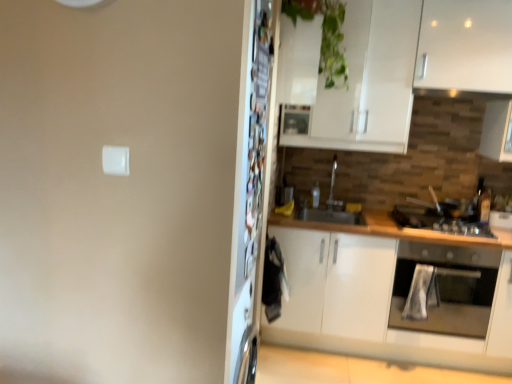
Question: Does metallic refrigerator at center lie in front of black matte gas stove at right?

Choices:
 (A) yes
 (B) no

Answer: (A)

Question: Considering the relative sizes of metallic refrigerator at center and black matte gas stove at right in the image provided, is metallic refrigerator at center taller than black matte gas stove at right?

Choices:
 (A) no
 (B) yes

Answer: (B)

Question: Can you confirm if metallic refrigerator at center is positioned to the right of black matte gas stove at right?

Choices:
 (A) yes
 (B) no

Answer: (B)

Question: From a real-world perspective, is metallic refrigerator at center physically above black matte gas stove at right?

Choices:
 (A) yes
 (B) no

Answer: (A)

Question: Is metallic refrigerator at center positioned beyond the bounds of black matte gas stove at right?

Choices:
 (A) yes
 (B) no

Answer: (A)

Question: In the image, is stainless steel oven at right positioned in front of or behind metallic silver exhaust hood at upper right?

Choices:
 (A) behind
 (B) front

Answer: (B)

Question: Based on their sizes in the image, would you say stainless steel oven at right is bigger or smaller than metallic silver exhaust hood at upper right?

Choices:
 (A) big
 (B) small

Answer: (A)

Question: From a real-world perspective, is stainless steel oven at right above or below metallic silver exhaust hood at upper right?

Choices:
 (A) below
 (B) above

Answer: (A)

Question: Do you think stainless steel oven at right is within metallic silver exhaust hood at upper right, or outside of it?

Choices:
 (A) inside
 (B) outside

Answer: (B)

Question: Relative to white matte cabinet at right, is green glossy plant at upper center in front or behind?

Choices:
 (A) front
 (B) behind

Answer: (A)

Question: From the image's perspective, is green glossy plant at upper center located above or below white matte cabinet at right?

Choices:
 (A) below
 (B) above

Answer: (B)

Question: Is green glossy plant at upper center wider or thinner than white matte cabinet at right?

Choices:
 (A) wide
 (B) thin

Answer: (B)

Question: From a real-world perspective, is green glossy plant at upper center above or below white matte cabinet at right?

Choices:
 (A) above
 (B) below

Answer: (A)

Question: From a real-world perspective, is black matte gas stove at right physically located above or below stainless steel oven at right?

Choices:
 (A) above
 (B) below

Answer: (A)

Question: Relative to stainless steel oven at right, is black matte gas stove at right in front or behind?

Choices:
 (A) front
 (B) behind

Answer: (B)